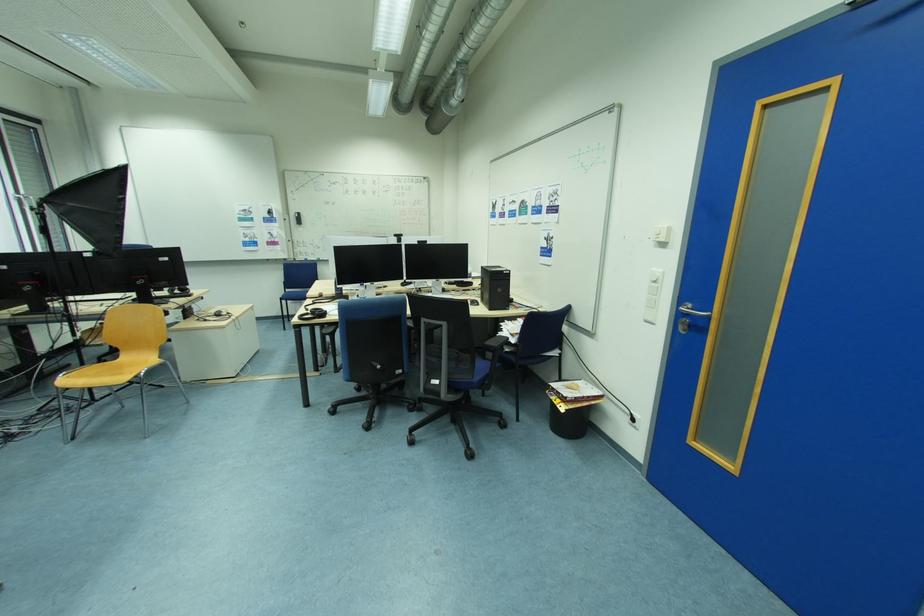
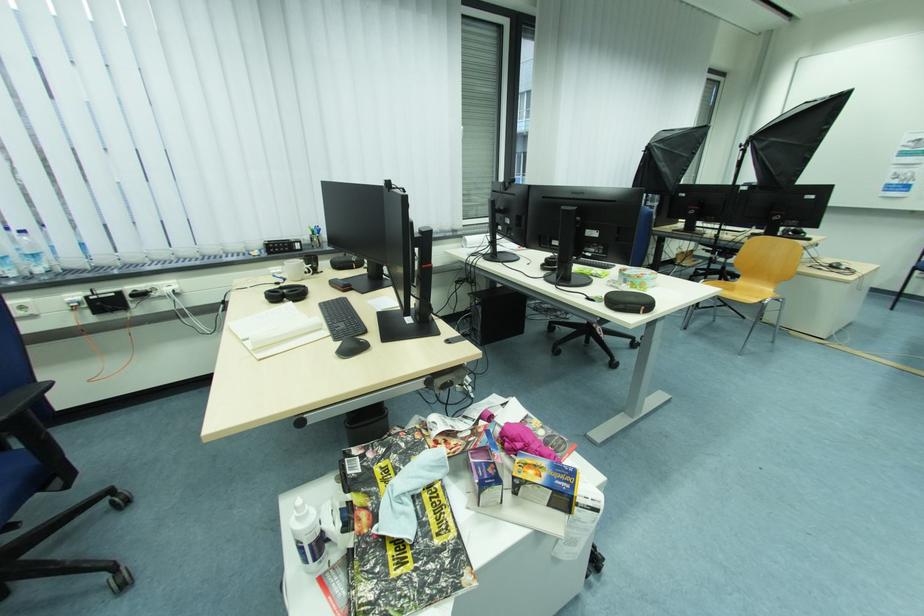
Locate, in the second image, the point that corresponds to [68,377] in the first image.

(710, 282)